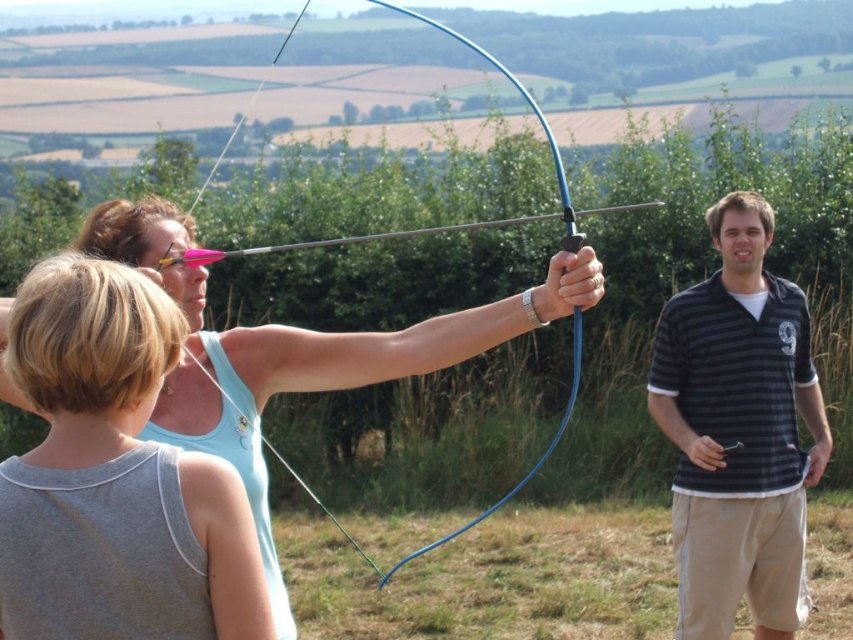
You are an archery instructor and you see the black striped polo shirt at right and the blue rubber bow at center. Which object is positioned further to the right?

The black striped polo shirt at right is positioned further to the right than the blue rubber bow at center.

You are an archer preparing to shoot an arrow. You have two targets in front of you, one wearing a black striped polo shirt at right and another wearing a light blue tank top at center. The safety rule states that you must ensure at least 5 meters between targets before shooting. Based on the scene description, can you safely shoot your arrow?

The distance between the black striped polo shirt at right and light blue tank top at center is 4.08 meters, which is less than the required 5 meters safety distance. Therefore, you cannot safely shoot your arrow.

You are an archer standing at the point marked as point [672,365] in the image. You want to shoot an arrow to the target located at the center of the image. The arrow can travel 10 meters before hitting the ground. Will your arrow reach the target?

The distance between you and the viewer is 6.34 meters, which is less than the arrow travel distance of 10 meters. Therefore, the arrow will reach the target.